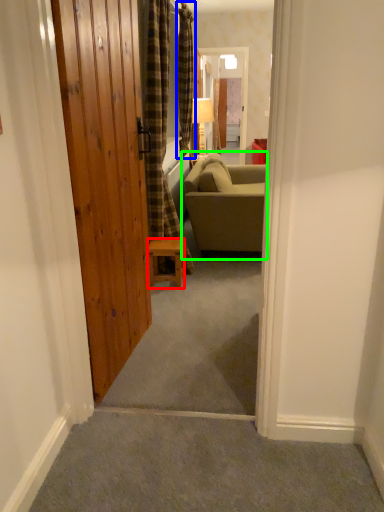
Question: Which is farther away from furniture (highlighted by a red box)? curtain (highlighted by a blue box) or studio couch (highlighted by a green box)?

Choices:
 (A) curtain
 (B) studio couch

Answer: (A)